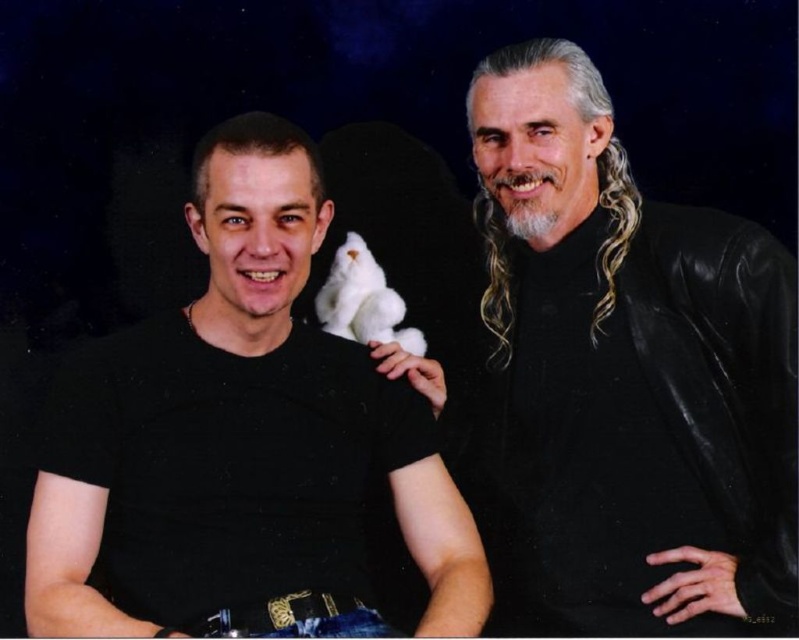
Question: From the image, what is the correct spatial relationship of black leather jacket at right in relation to white plush toy at center?

Choices:
 (A) below
 (B) above

Answer: (A)

Question: Based on their relative distances, which object is nearer to the black matte t-shirt at left?

Choices:
 (A) black leather jacket at right
 (B) white plush toy at center

Answer: (A)

Question: Which of these objects is positioned farthest from the white plush toy at center?

Choices:
 (A) black matte t-shirt at left
 (B) black leather jacket at right

Answer: (A)

Question: Is black matte t-shirt at left below white plush toy at center?

Choices:
 (A) yes
 (B) no

Answer: (A)

Question: Does black leather jacket at right appear over black matte t-shirt at left?

Choices:
 (A) yes
 (B) no

Answer: (A)

Question: Which point is closer to the camera?

Choices:
 (A) black leather jacket at right
 (B) black matte t-shirt at left
 (C) white plush toy at center

Answer: (B)